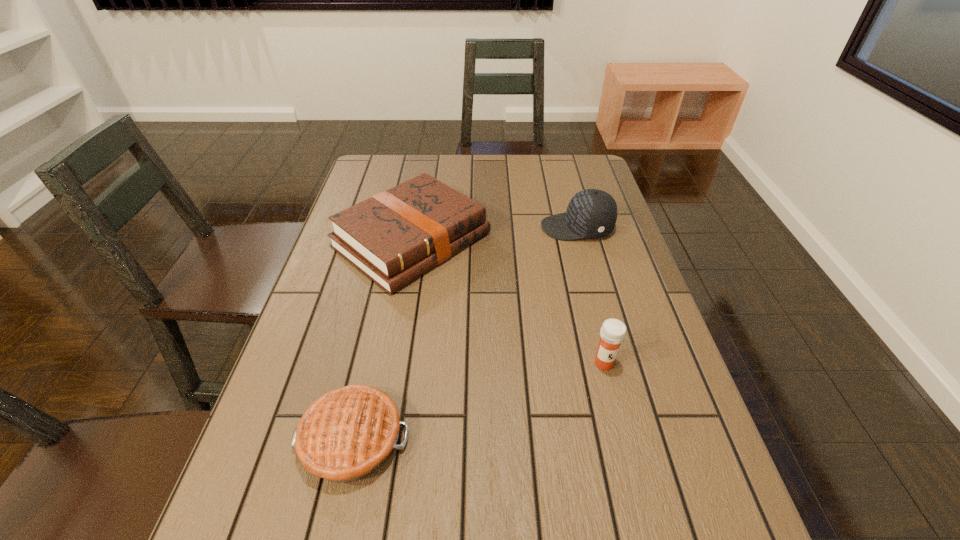
Locate an element on the screen. vacant space situated on the right of the pie is located at coordinates (526, 438).

Image resolution: width=960 pixels, height=540 pixels. I want to click on hardback book located in the left edge section of the desktop, so click(x=397, y=235).

Locate an element on the screen. The width and height of the screenshot is (960, 540). pie at the left edge is located at coordinates (348, 433).

You are a GUI agent. You are given a task and a screenshot of the screen. Output one action in this format:
    pyautogui.click(x=<x>, y=<y>)
    Task: Click on the baseball cap that is positioned at the right edge
    
    Given the screenshot: What is the action you would take?
    pyautogui.click(x=592, y=213)

At what (x,y) coordinates should I click in order to perform the action: click on medicine present at the right edge. Please return your answer as a coordinate pair (x, y). The height and width of the screenshot is (540, 960). Looking at the image, I should click on (613, 331).

In the image, there is a desktop. Where is `vacant region at the far edge`? vacant region at the far edge is located at coordinates (556, 180).

Image resolution: width=960 pixels, height=540 pixels. I want to click on vacant space at the left edge, so click(x=335, y=322).

Image resolution: width=960 pixels, height=540 pixels. In the image, there is a desktop. Find the location of `vacant space at the right edge`. vacant space at the right edge is located at coordinates (624, 291).

You are a GUI agent. You are given a task and a screenshot of the screen. Output one action in this format:
    pyautogui.click(x=<x>, y=<y>)
    Task: Click on the free point at the far left corner
    
    Given the screenshot: What is the action you would take?
    pyautogui.click(x=395, y=175)

In the image, there is a desktop. Identify the location of vacant space at the far right corner. (559, 174).